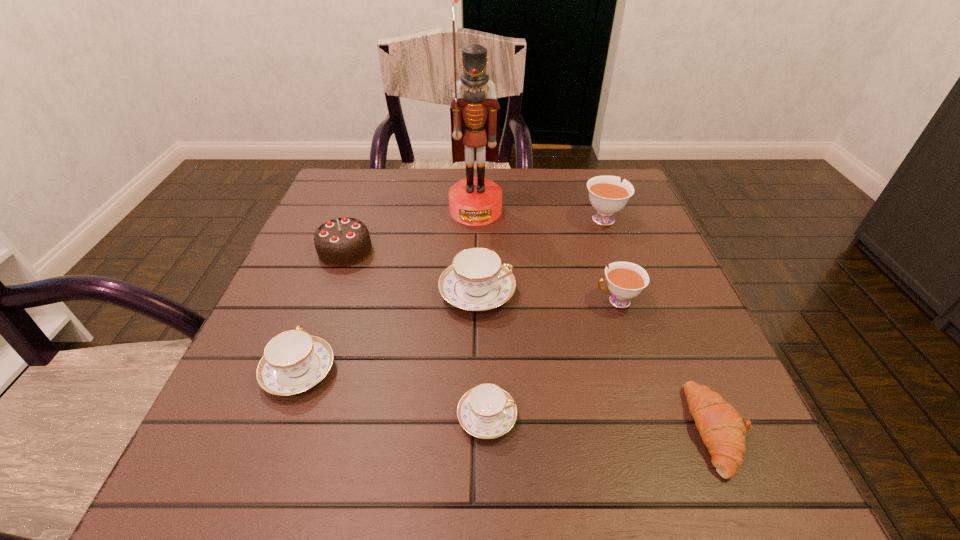
In order to click on vacant space situated 0.290m on the side with the handle of the leftmost teacup in this screenshot , I will do `click(347, 242)`.

What are the coordinates of `free spot located on the side with the handle of the leftmost teacup` in the screenshot? It's located at (355, 218).

The height and width of the screenshot is (540, 960). Find the location of `vacant region located on the side with the handle of the leftmost teacup`. vacant region located on the side with the handle of the leftmost teacup is located at coordinates (341, 257).

Where is `free point located 0.090m on the side with the handle of the smallest blue teacup`? This screenshot has width=960, height=540. free point located 0.090m on the side with the handle of the smallest blue teacup is located at coordinates (576, 416).

Find the location of a particular element. Image resolution: width=960 pixels, height=540 pixels. vacant point located 0.050m on the left of the crescent roll is located at coordinates (659, 429).

Where is `nutcracker situated at the far edge`? The width and height of the screenshot is (960, 540). nutcracker situated at the far edge is located at coordinates (475, 118).

The width and height of the screenshot is (960, 540). Identify the location of teacup at the far edge. (607, 194).

You are a GUI agent. You are given a task and a screenshot of the screen. Output one action in this format:
    pyautogui.click(x=<x>, y=<y>)
    Task: Click on the teacup positioned at the near edge
    The width and height of the screenshot is (960, 540).
    Given the screenshot: What is the action you would take?
    pyautogui.click(x=486, y=411)

This screenshot has height=540, width=960. I want to click on crescent roll that is positioned at the near edge, so click(x=721, y=427).

The image size is (960, 540). I want to click on chocolate cake positioned at the left edge, so click(340, 242).